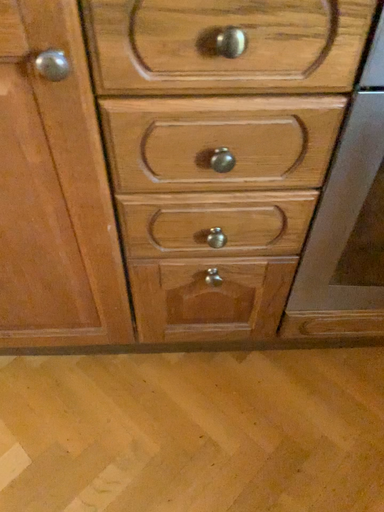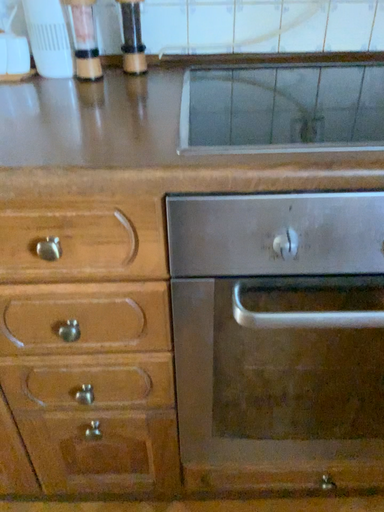
Question: How did the camera likely rotate when shooting the video?

Choices:
 (A) rotated upward
 (B) rotated downward

Answer: (A)